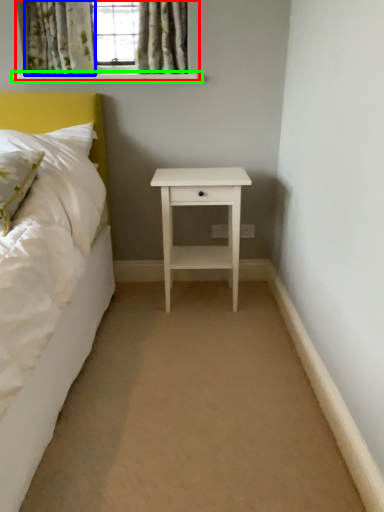
Question: Which is farther away from window (highlighted by a red box)? curtain (highlighted by a blue box) or window sill (highlighted by a green box)?

Choices:
 (A) curtain
 (B) window sill

Answer: (B)